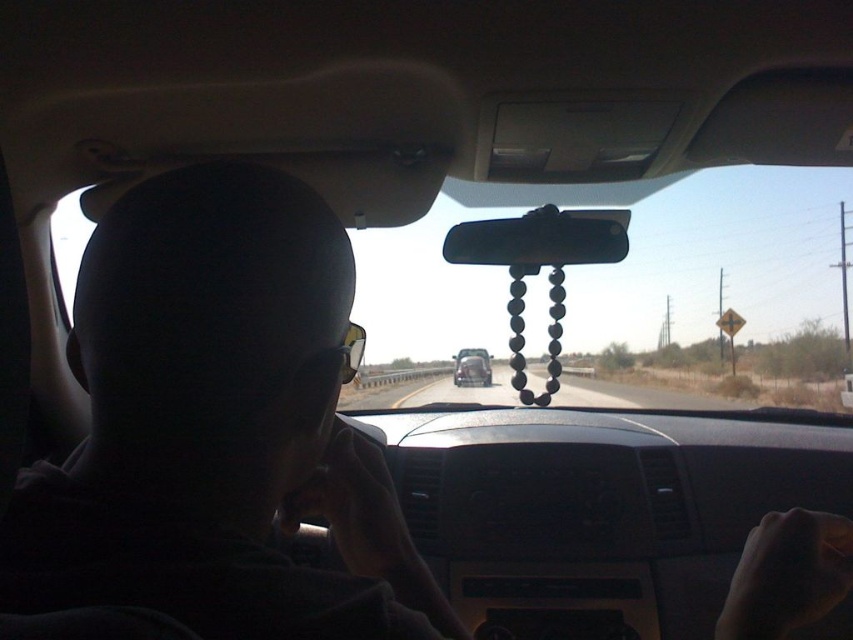
Can you confirm if black glossy mirror at center is positioned above metallic silver car at center?

Correct, black glossy mirror at center is located above metallic silver car at center.

Between black glossy mirror at center and metallic silver car at center, which one appears on the left side from the viewer's perspective?

From the viewer's perspective, metallic silver car at center appears more on the left side.

Is point (544, 230) positioned in front of point (465, 356)?

That is True.

You are a GUI agent. You are given a task and a screenshot of the screen. Output one action in this format:
    pyautogui.click(x=<x>, y=<y>)
    Task: Click on the black glossy mirror at center
    Image resolution: width=853 pixels, height=640 pixels.
    Given the screenshot: What is the action you would take?
    pyautogui.click(x=540, y=240)